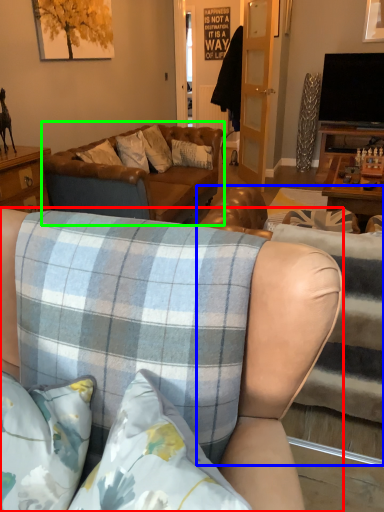
Question: Considering the real-world distances, which object is closest to studio couch (highlighted by a red box)? studio couch (highlighted by a blue box) or studio couch (highlighted by a green box).

Choices:
 (A) studio couch
 (B) studio couch

Answer: (A)